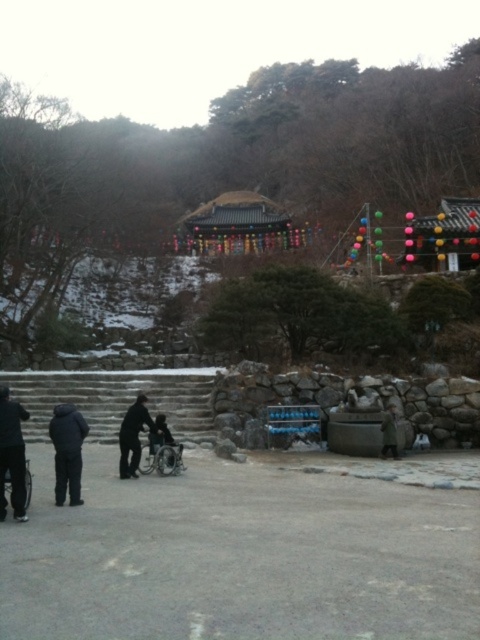
Which of these two, stone steps at center or green woolen coat at lower right, stands shorter?

Standing shorter between the two is green woolen coat at lower right.

Is stone steps at center wider than green woolen coat at lower right?

Indeed, stone steps at center has a greater width compared to green woolen coat at lower right.

The width and height of the screenshot is (480, 640). Find the location of `stone steps at center`. stone steps at center is located at coordinates (116, 397).

Find the location of a particular element. The width and height of the screenshot is (480, 640). stone steps at center is located at coordinates (116, 397).

Who is more distant from viewer, (60, 486) or (168, 444)?

The point (168, 444) is more distant.

Does point (81, 452) come in front of point (156, 424)?

Yes, point (81, 452) is closer to viewer.

Where is `black matte jacket at lower left`? Image resolution: width=480 pixels, height=640 pixels. black matte jacket at lower left is located at coordinates (68, 451).

Describe the element at coordinates (68, 451) in the screenshot. I see `black matte jacket at lower left` at that location.

Consider the image. Who is more forward, (56, 428) or (132, 426)?

Positioned in front is point (56, 428).

Where is `black matte jacket at lower left`? The height and width of the screenshot is (640, 480). black matte jacket at lower left is located at coordinates (68, 451).